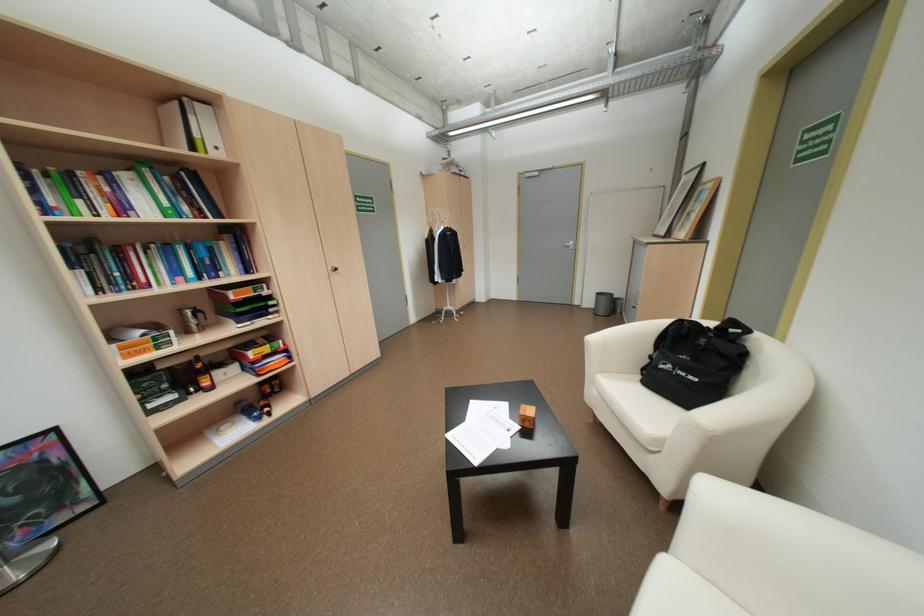
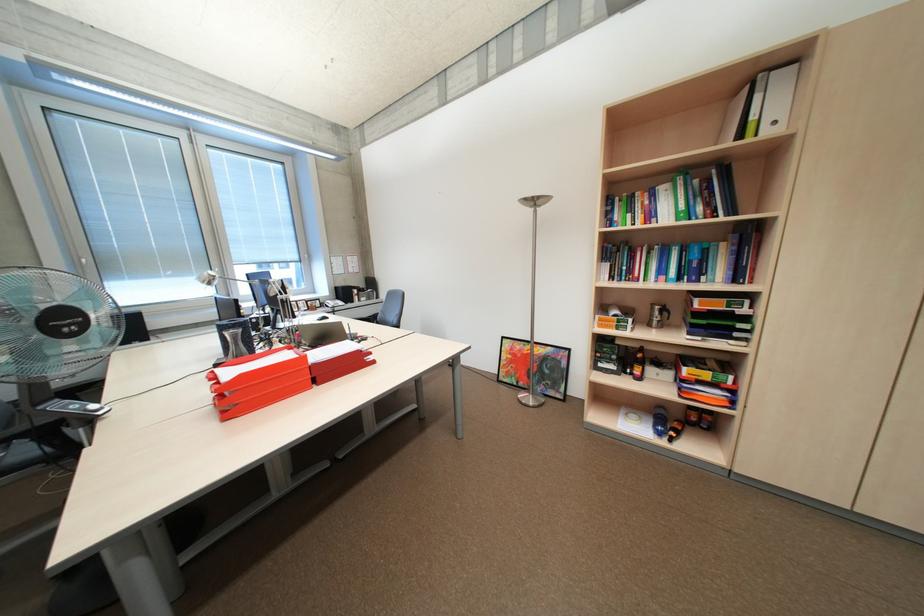
The point at (201, 116) is marked in the first image. Where is the corresponding point in the second image?

(768, 97)